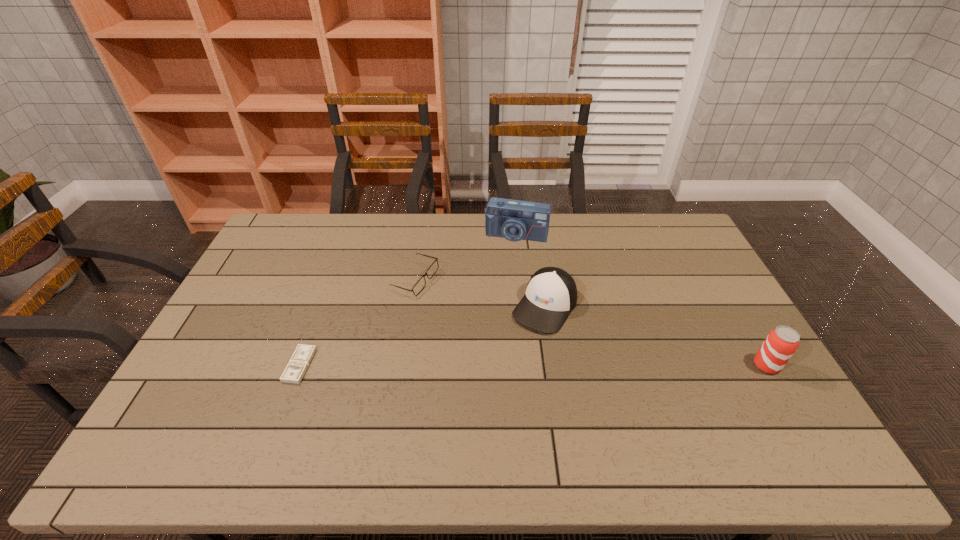
Where is `the leftmost object`? This screenshot has height=540, width=960. the leftmost object is located at coordinates tap(303, 354).

You are a GUI agent. You are given a task and a screenshot of the screen. Output one action in this format:
    pyautogui.click(x=<x>, y=<y>)
    Task: Click on the shortest object
    The width and height of the screenshot is (960, 540).
    Given the screenshot: What is the action you would take?
    pyautogui.click(x=303, y=354)

In order to click on beer can in this screenshot , I will do `click(781, 343)`.

Identify the location of the fourth object from right to left. (419, 286).

At what (x,y) coordinates should I click in order to perform the action: click on the fourth tallest object. Please return your answer as a coordinate pair (x, y). The image size is (960, 540). Looking at the image, I should click on (419, 286).

The width and height of the screenshot is (960, 540). What are the coordinates of `camera` in the screenshot? It's located at (515, 220).

You are a GUI agent. You are given a task and a screenshot of the screen. Output one action in this format:
    pyautogui.click(x=<x>, y=<y>)
    Task: Click on the cap
    This screenshot has width=960, height=540.
    Given the screenshot: What is the action you would take?
    pyautogui.click(x=551, y=294)

The width and height of the screenshot is (960, 540). Find the location of `free space located 0.170m on the back of the money`. free space located 0.170m on the back of the money is located at coordinates (322, 305).

The width and height of the screenshot is (960, 540). I want to click on vacant space located 0.240m on the left of the rightmost object, so click(667, 366).

I want to click on free space located with the lenses facing outward on the fourth object from right to left, so click(x=472, y=349).